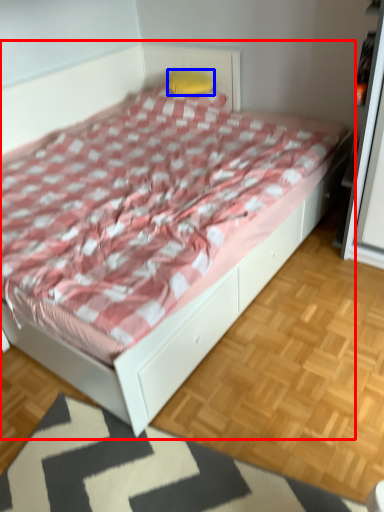
Question: Which of the following is the farthest to the observer, bed (highlighted by a red box) or pillow (highlighted by a blue box)?

Choices:
 (A) bed
 (B) pillow

Answer: (B)